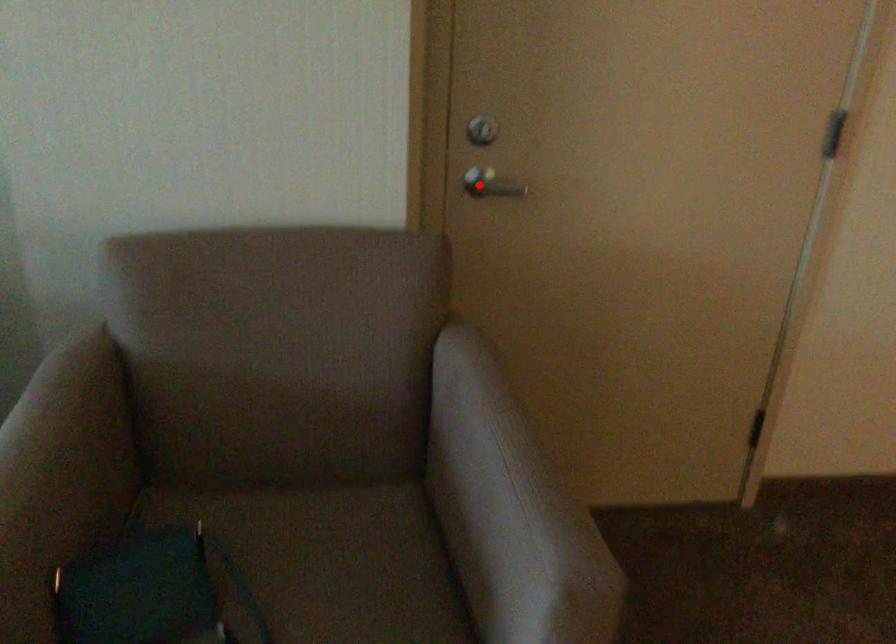
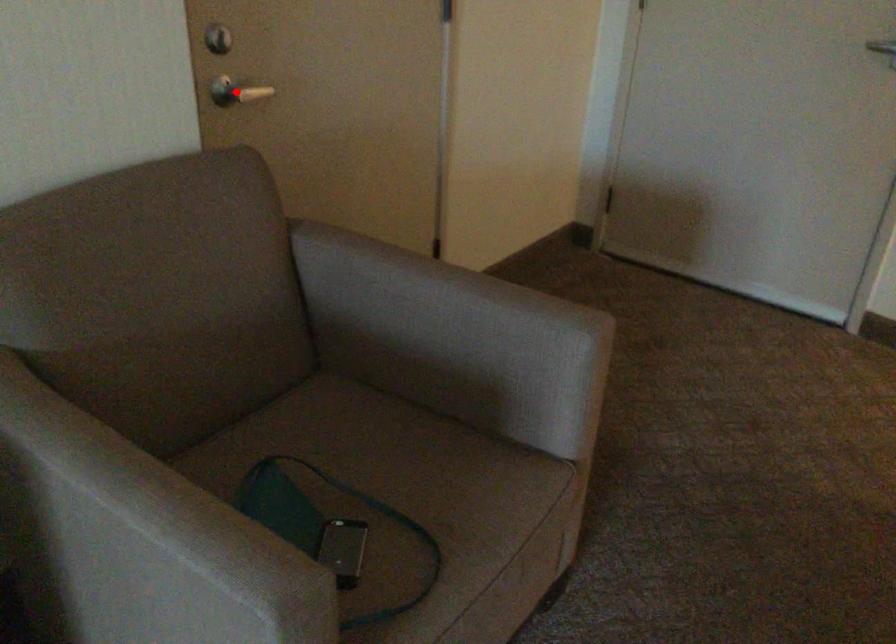
I am providing you with two images of the same scene from different viewpoints. A red point is marked on the first image and another point is marked on the second image. Do the highlighted points in image1 and image2 indicate the same real-world spot?

Yes